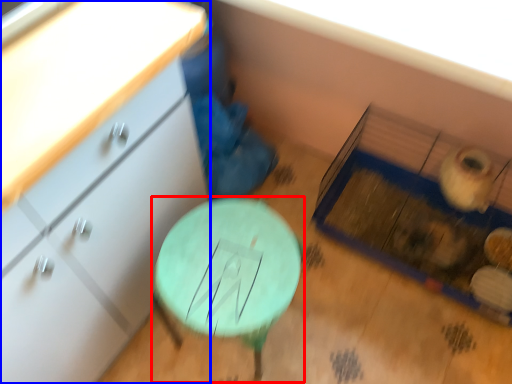
Question: Which object appears farthest to the camera in this image, table (highlighted by a red box) or chest of drawers (highlighted by a blue box)?

Choices:
 (A) table
 (B) chest of drawers

Answer: (A)